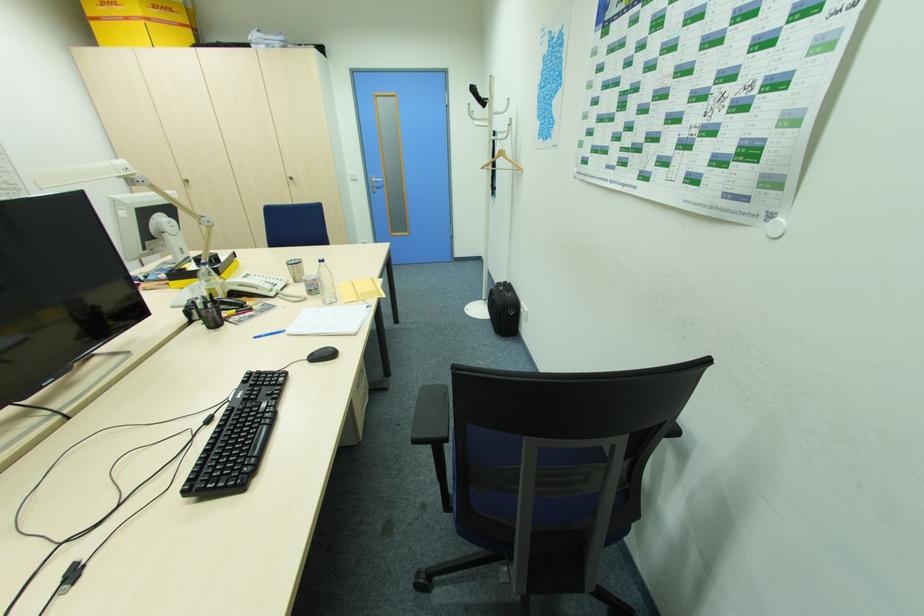
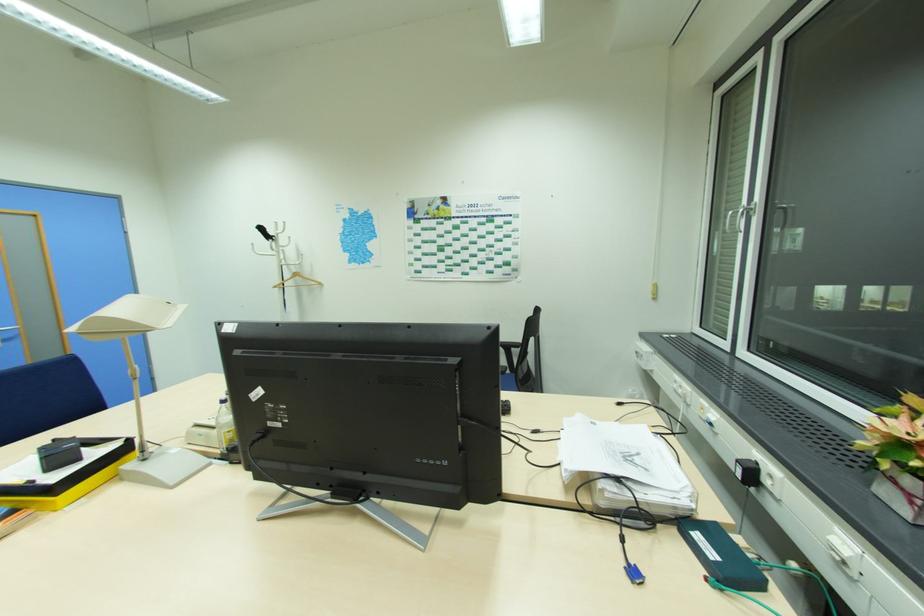
Find the pixel in the second image that matches the point at 490,99 in the first image.

(276, 237)